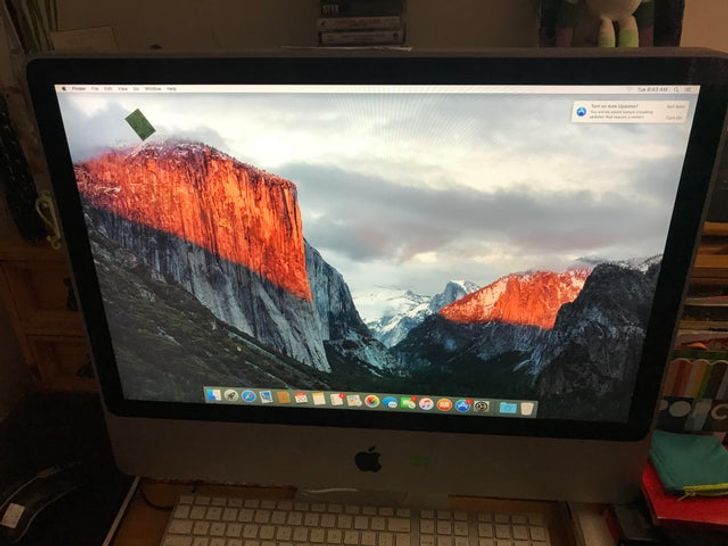
Find the location of `apple imac 20-inch august 2007 2ghz intel core 2 duo`. apple imac 20-inch august 2007 2ghz intel core 2 duo is located at coordinates point(395,176).